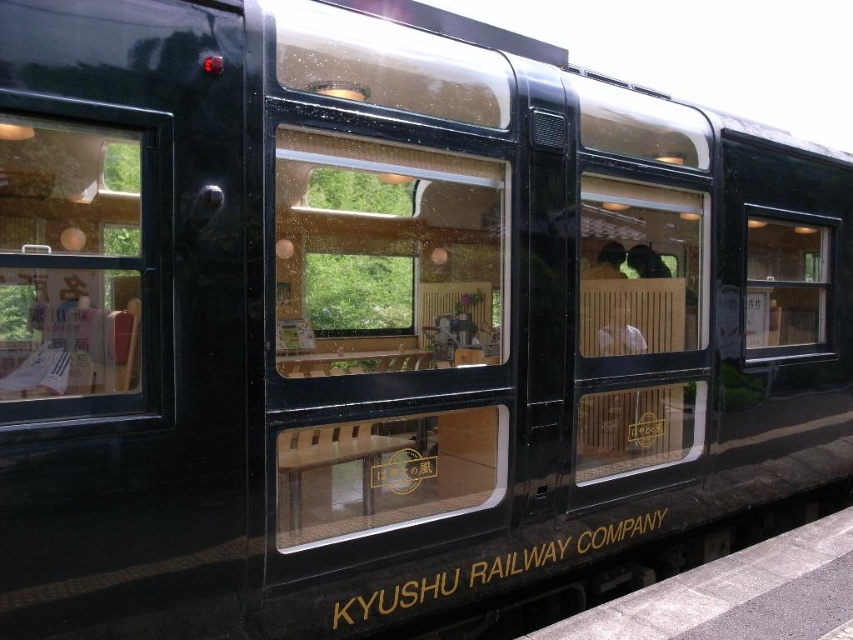
Consider the image. Can you confirm if transparent glass window at left is positioned to the right of clear glass window at center?

No, transparent glass window at left is not to the right of clear glass window at center.

Between transparent glass window at left and clear glass window at center, which one appears on the left side from the viewer's perspective?

transparent glass window at left

Is point (16, 237) more distant than point (636, 364)?

No, it is in front of (636, 364).

The image size is (853, 640). In order to click on transparent glass window at left in this screenshot , I will do `click(77, 266)`.

Which of these two, clear glass window at center or clear glass window at right, stands shorter?

Standing shorter between the two is clear glass window at right.

Where is `clear glass window at center`? The height and width of the screenshot is (640, 853). clear glass window at center is located at coordinates (637, 324).

Where is `clear glass window at center`? clear glass window at center is located at coordinates (637, 324).

I want to click on clear glass window at center, so click(x=637, y=324).

Who is more distant from viewer, [351,253] or [819,248]?

Positioned behind is point [351,253].

Is transparent glass train window at center shorter than clear glass window at right?

No, transparent glass train window at center is not shorter than clear glass window at right.

Describe the element at coordinates (386, 259) in the screenshot. This screenshot has height=640, width=853. I see `transparent glass train window at center` at that location.

The height and width of the screenshot is (640, 853). In order to click on transparent glass train window at center in this screenshot , I will do `click(386, 259)`.